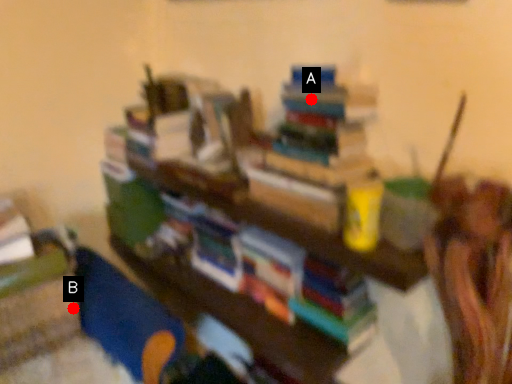
Question: Two points are circled on the image, labeled by A and B beside each circle. Which point is further to the camera?

Choices:
 (A) A is further
 (B) B is further

Answer: (B)